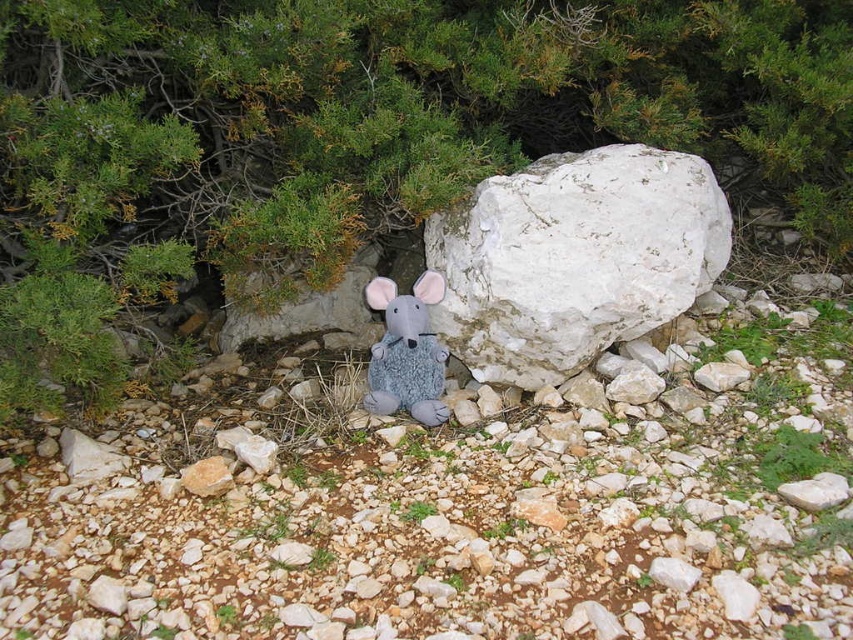
Is point (531, 346) positioned in front of point (419, 400)?

Yes, point (531, 346) is closer to viewer.

Can you confirm if white rough rock at center is shorter than fuzzy gray plush mouse at center?

No, white rough rock at center is not shorter than fuzzy gray plush mouse at center.

In order to click on white rough rock at center in this screenshot , I will do `click(573, 259)`.

Is green leafy tree at upper center smaller than white rough rock at center?

Actually, green leafy tree at upper center might be larger than white rough rock at center.

Who is positioned more to the right, green leafy tree at upper center or white rough rock at center?

From the viewer's perspective, white rough rock at center appears more on the right side.

What do you see at coordinates (358, 134) in the screenshot? I see `green leafy tree at upper center` at bounding box center [358, 134].

Locate an element on the screen. The width and height of the screenshot is (853, 640). green leafy tree at upper center is located at coordinates (358, 134).

Does green leafy tree at upper center appear on the left side of fuzzy gray plush mouse at center?

No, green leafy tree at upper center is not to the left of fuzzy gray plush mouse at center.

Measure the distance between green leafy tree at upper center and camera.

They are 1.90 meters apart.

Find the location of a particular element. The image size is (853, 640). green leafy tree at upper center is located at coordinates (358, 134).